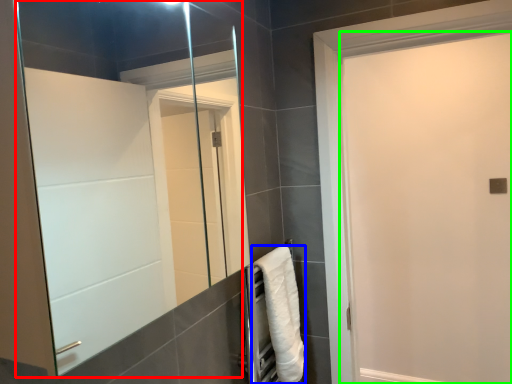
Question: Which object is positioned farthest from mirror (highlighted by a red box)? Select from towel (highlighted by a blue box) and screen door (highlighted by a green box).

Choices:
 (A) towel
 (B) screen door

Answer: (B)